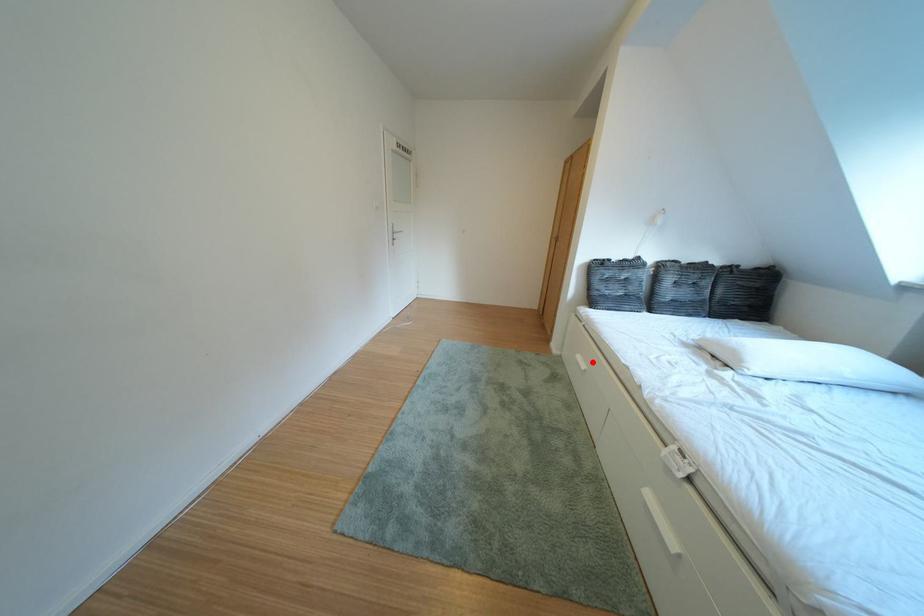
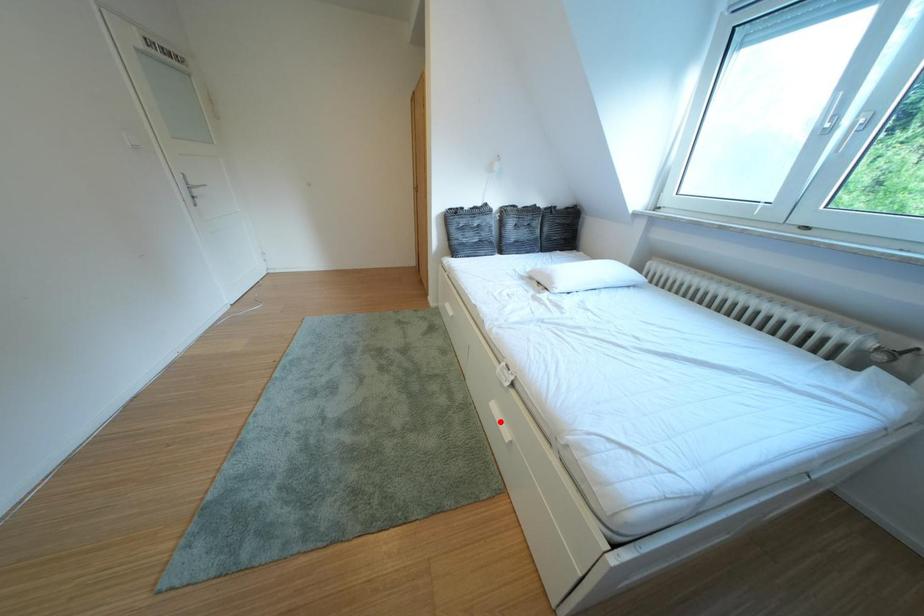
In the scene shown: I am providing you with two images of the same scene from different viewpoints. A red point is marked on the first image and another point is marked on the second image. Is the red point in image1 aligned with the point shown in image2?

No